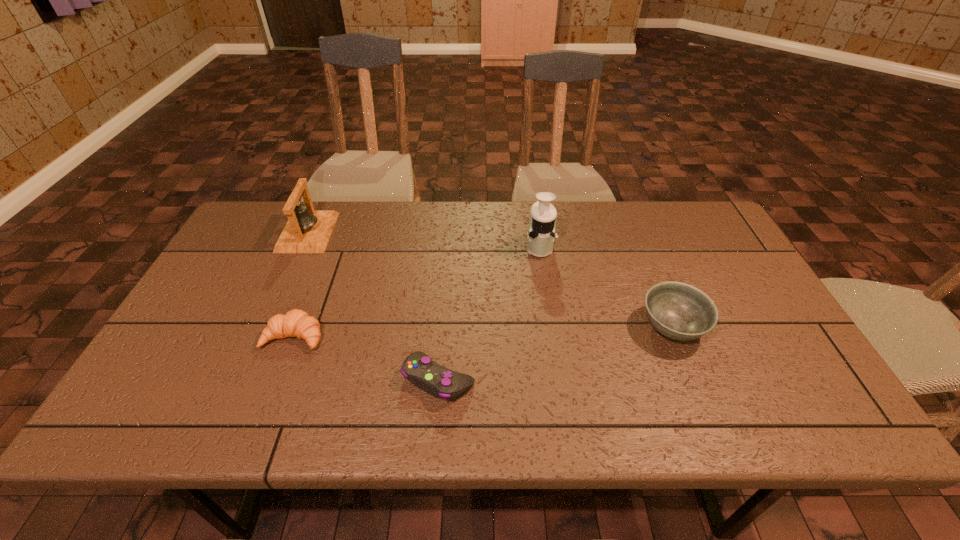
Where is `empty location between the rightmost object and the third object from left to right`? This screenshot has height=540, width=960. empty location between the rightmost object and the third object from left to right is located at coordinates (555, 353).

Identify the location of free area in between the control and the crescent roll. (367, 357).

The height and width of the screenshot is (540, 960). Identify the location of object that is the second closest to the fourth object from left to right. (434, 379).

Where is `the third closest object relative to the third shortest object`? This screenshot has width=960, height=540. the third closest object relative to the third shortest object is located at coordinates (297, 323).

Locate an element on the screen. The image size is (960, 540). vacant area in the image that satisfies the following two spatial constraints: 1. on the back side of the tallest object; 2. on the right side of the crescent roll is located at coordinates (328, 247).

Identify the location of free space in the image that satisfies the following two spatial constraints: 1. on the front side of the second tallest object; 2. on the left side of the tallest object. (301, 247).

Identify the location of free spot that satisfies the following two spatial constraints: 1. on the front side of the second tallest object; 2. on the left side of the crescent roll. This screenshot has height=540, width=960. (261, 336).